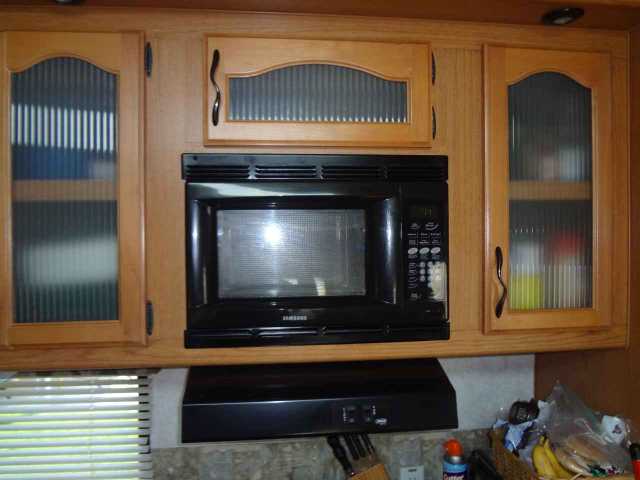
Image resolution: width=640 pixels, height=480 pixels. In order to click on 2 different types of walls in this screenshot , I will do `click(486, 399)`, `click(294, 458)`.